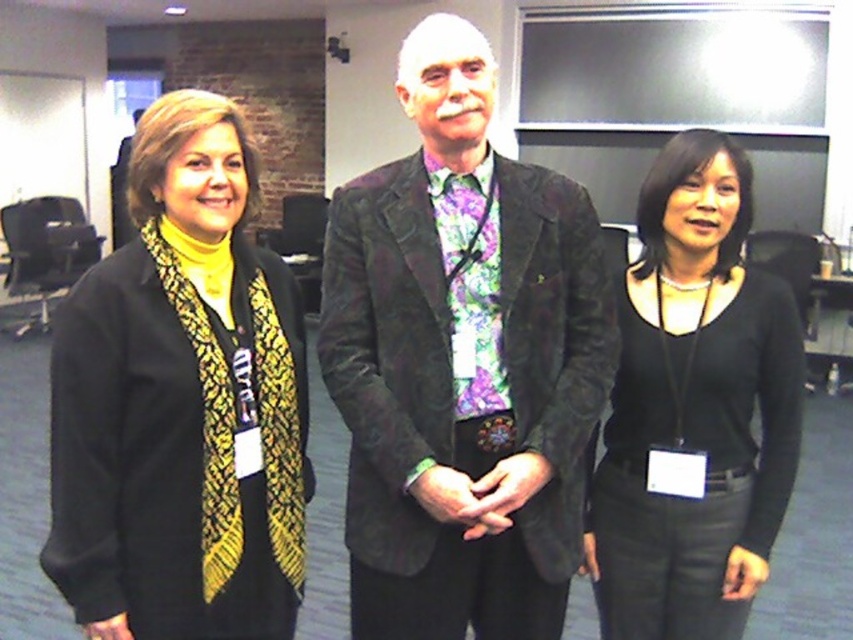
Is black matte shirt at right further to the viewer compared to floral silk tie at center?

Yes, it is.

Does point (601, 550) come closer to viewer compared to point (450, 218)?

No, (601, 550) is further to viewer.

Where is `black matte shirt at right`? The image size is (853, 640). black matte shirt at right is located at coordinates (695, 406).

Who is positioned more to the right, velvet-like brown blazer at center or floral silk tie at center?

floral silk tie at center is more to the right.

Describe the element at coordinates (462, 364) in the screenshot. I see `velvet-like brown blazer at center` at that location.

This screenshot has height=640, width=853. I want to click on velvet-like brown blazer at center, so click(x=462, y=364).

Does black textured scarf at left have a larger size compared to floral silk tie at center?

Yes, black textured scarf at left is bigger than floral silk tie at center.

Can you confirm if black textured scarf at left is positioned to the left of floral silk tie at center?

Yes, black textured scarf at left is to the left of floral silk tie at center.

Is point (131, 172) behind point (453, 310)?

No, it is in front of (453, 310).

Locate an element on the screen. black textured scarf at left is located at coordinates (181, 403).